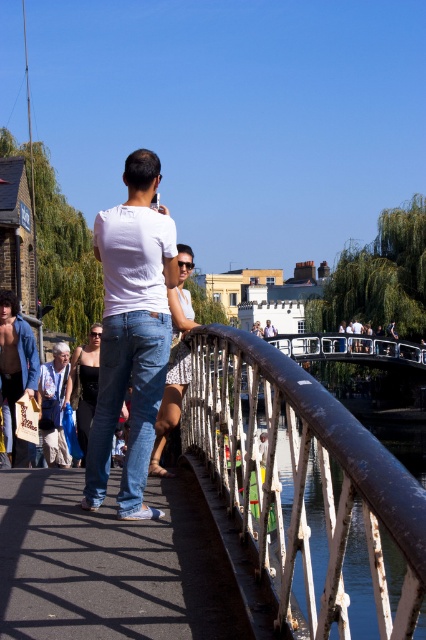
You are a tourist standing on the pedestrian bridge and want to take a photo of the canal without any obstructions. The rusty metal railing at center and the white cotton shirt at upper center are in your view. Which object should you move to avoid blocking your shot?

The white cotton shirt at upper center is above the rusty metal railing at center, so moving the white cotton shirt at upper center would allow an unobstructed view of the canal.

Based on the scene description, where is the white matte shirt at center located in the image?

The white matte shirt at center is located at point 0.519 on the x axis and 0.310 on the y axis.